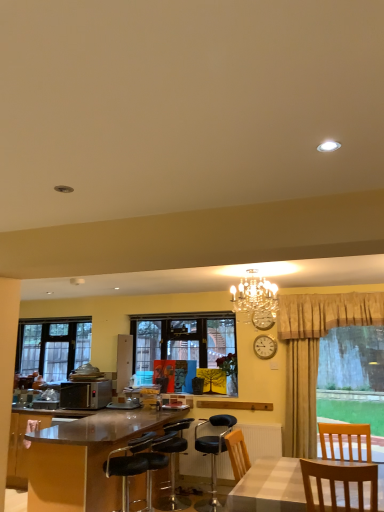
Question: In the image, is shiny brown desk at lower left positioned in front of or behind gold metallic clock at upper center?

Choices:
 (A) behind
 (B) front

Answer: (B)

Question: Based on their positions, is shiny brown desk at lower left located to the left or right of gold metallic clock at upper center?

Choices:
 (A) left
 (B) right

Answer: (A)

Question: Considering the real-world distances, which object is farthest from the metallic silver teapot at center?

Choices:
 (A) yellow matte picture frame at center
 (B) black leather bar stool at lower left, which is the second chair from front to back
 (C) wooden chair at center
 (D) crystal chandelier at upper center
 (E) clear glass window at left, which is counted as the second window, starting from the right

Answer: (D)

Question: Which is farther from the shiny brown desk at lower left?

Choices:
 (A) yellow matte picture frame at center
 (B) clear glass window at left, which is counted as the second window, starting from the right
 (C) wooden chair at center
 (D) black leather bar stool at lower left, which is the second chair from front to back
 (E) satin silver microwave at left

Answer: (B)